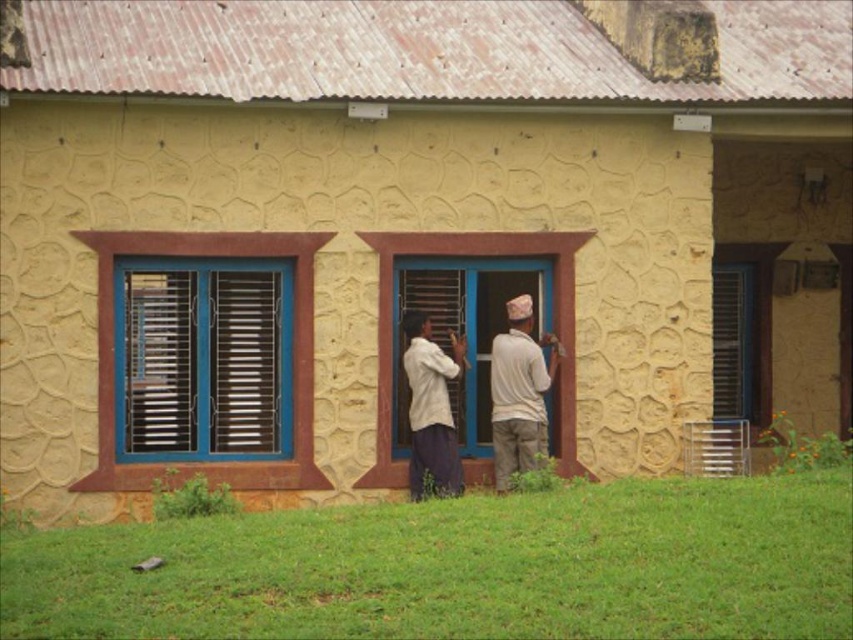
Question: Which is farther from the matte metal shutter at right?

Choices:
 (A) brown wooden shutter at left
 (B) matte wood shutter at center

Answer: (A)

Question: Does blue metallic window at center appear under matte wood shutter at center?

Choices:
 (A) no
 (B) yes

Answer: (B)

Question: Is blue metallic window at center above light beige fabric shirt at center?

Choices:
 (A) yes
 (B) no

Answer: (A)

Question: Which of the following is the closest to the observer?

Choices:
 (A) (500, 360)
 (B) (250, 353)
 (C) (502, 468)
 (D) (238, 275)

Answer: (D)

Question: Considering the relative positions of light beige fabric shirt at center and brown wooden shutter at left in the image provided, where is light beige fabric shirt at center located with respect to brown wooden shutter at left?

Choices:
 (A) below
 (B) above

Answer: (A)

Question: Which object is the closest to the matte metal shutter at right?

Choices:
 (A) blue metallic window at center
 (B) white cotton shirt at center
 (C) light beige fabric shirt at center
 (D) brown wooden shutter at left

Answer: (C)